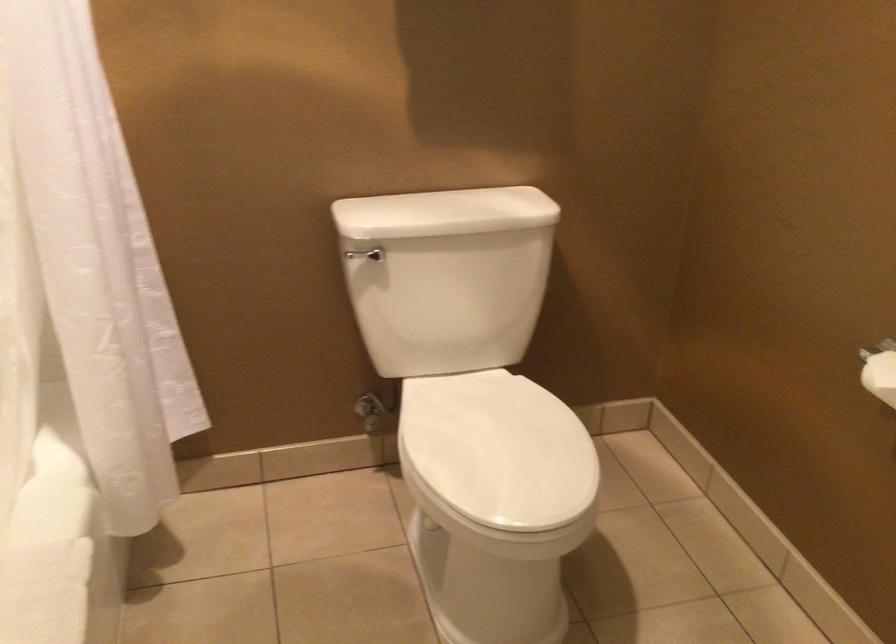
Where would you pull the toilet paper roll? Please return your answer as a coordinate pair (x, y).

(880, 375)